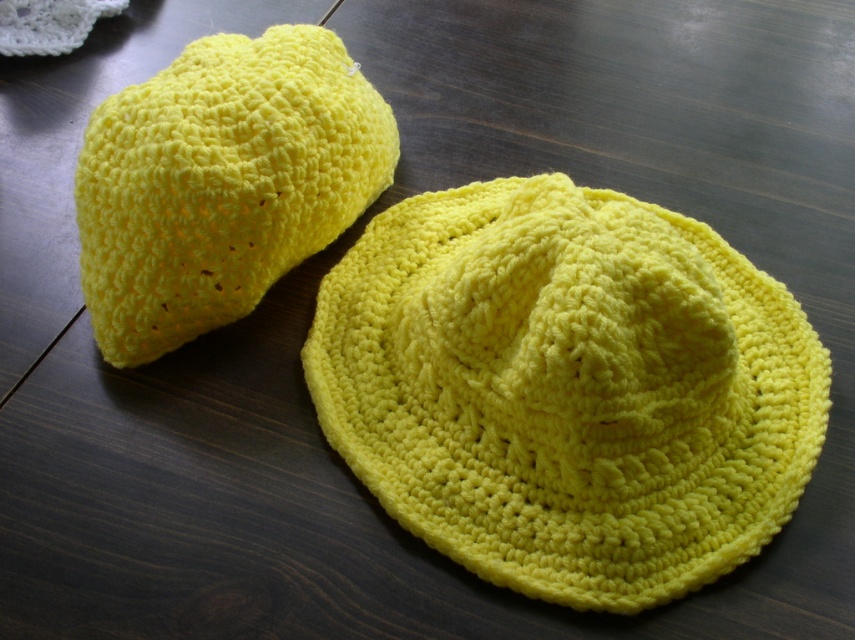
Question: Is yellow crochet hat at center above yellow crochet hat at upper left?

Choices:
 (A) yes
 (B) no

Answer: (B)

Question: Is yellow crochet hat at center positioned before yellow crochet hat at upper left?

Choices:
 (A) yes
 (B) no

Answer: (A)

Question: Which point is closer to the camera?

Choices:
 (A) (711, 480)
 (B) (314, 196)

Answer: (A)

Question: Is yellow crochet hat at center to the right of yellow crochet hat at upper left from the viewer's perspective?

Choices:
 (A) no
 (B) yes

Answer: (B)

Question: Which point appears farthest from the camera in this image?

Choices:
 (A) (444, 385)
 (B) (231, 140)

Answer: (A)

Question: Which point is farther from the camera taking this photo?

Choices:
 (A) (404, 362)
 (B) (198, 221)

Answer: (A)